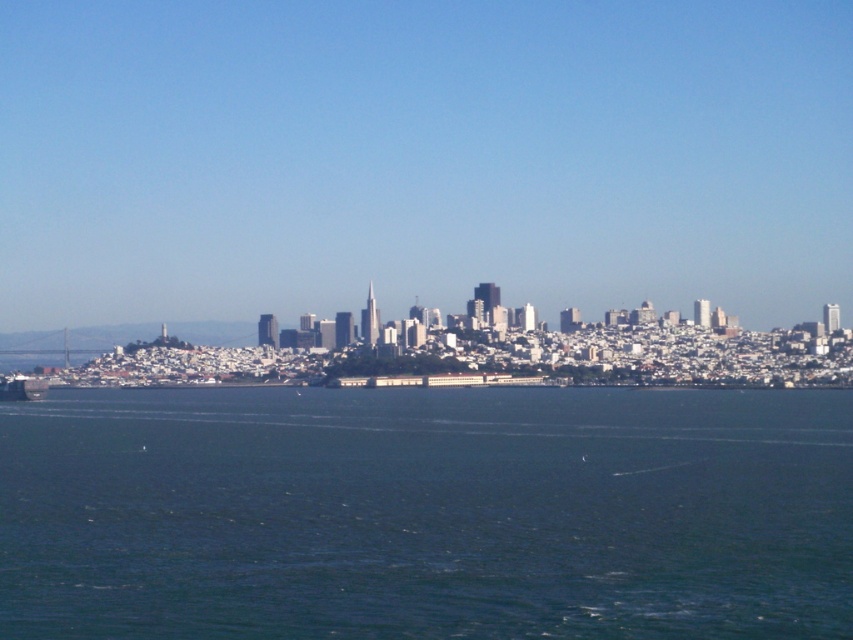
Who is higher up, blue liquid water at center or metallic gray ship at lower left?

metallic gray ship at lower left is above.

Who is taller, blue liquid water at center or metallic gray ship at lower left?

Standing taller between the two is blue liquid water at center.

The image size is (853, 640). What do you see at coordinates (426, 513) in the screenshot?
I see `blue liquid water at center` at bounding box center [426, 513].

Locate an element on the screen. blue liquid water at center is located at coordinates (426, 513).